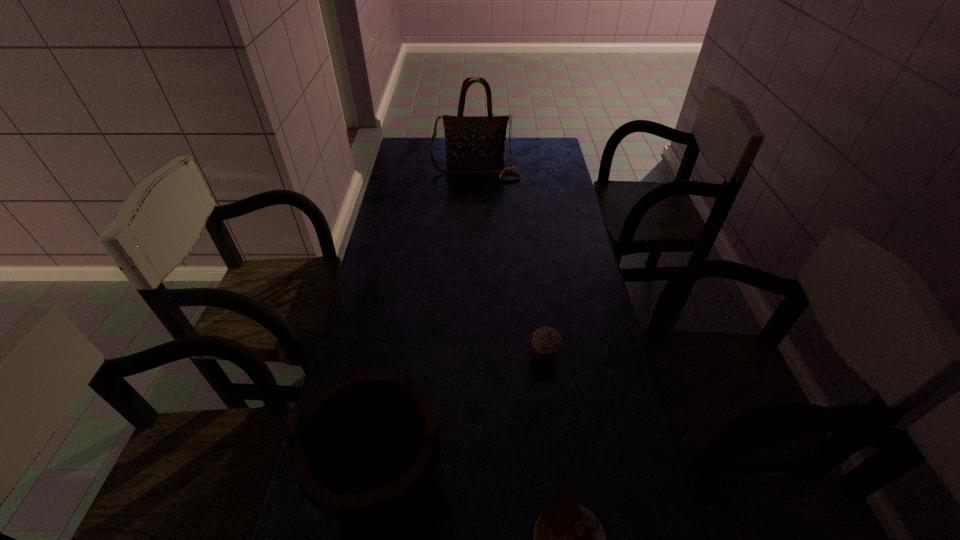
Locate an element on the screen. Image resolution: width=960 pixels, height=540 pixels. the farthest object is located at coordinates (472, 142).

Identify the location of handbag. (472, 142).

The image size is (960, 540). I want to click on the second shortest object, so click(x=546, y=342).

I want to click on muffin, so click(546, 342).

Identify the location of vacant space located 0.160m on the front-facing side of the farthest object. The image size is (960, 540). (474, 205).

The height and width of the screenshot is (540, 960). Identify the location of vacant space located 0.320m on the front of the second farthest object. click(x=562, y=494).

Find the location of `object located at the far edge`. object located at the far edge is located at coordinates (x=472, y=142).

This screenshot has width=960, height=540. Find the location of `object situated at the left edge`. object situated at the left edge is located at coordinates (472, 142).

Locate an element on the screen. object at the right edge is located at coordinates (546, 342).

Where is `object present at the far left corner`? The width and height of the screenshot is (960, 540). object present at the far left corner is located at coordinates (472, 142).